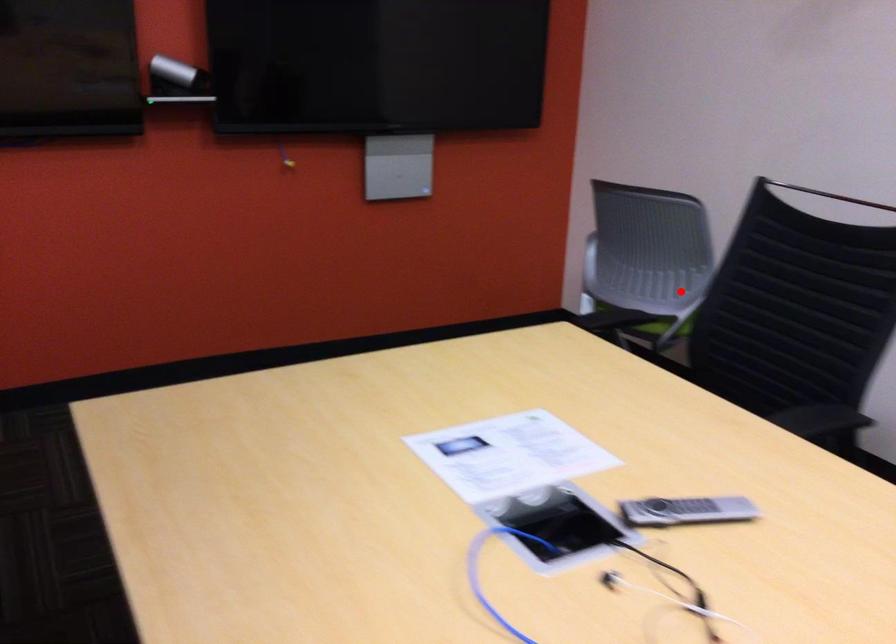
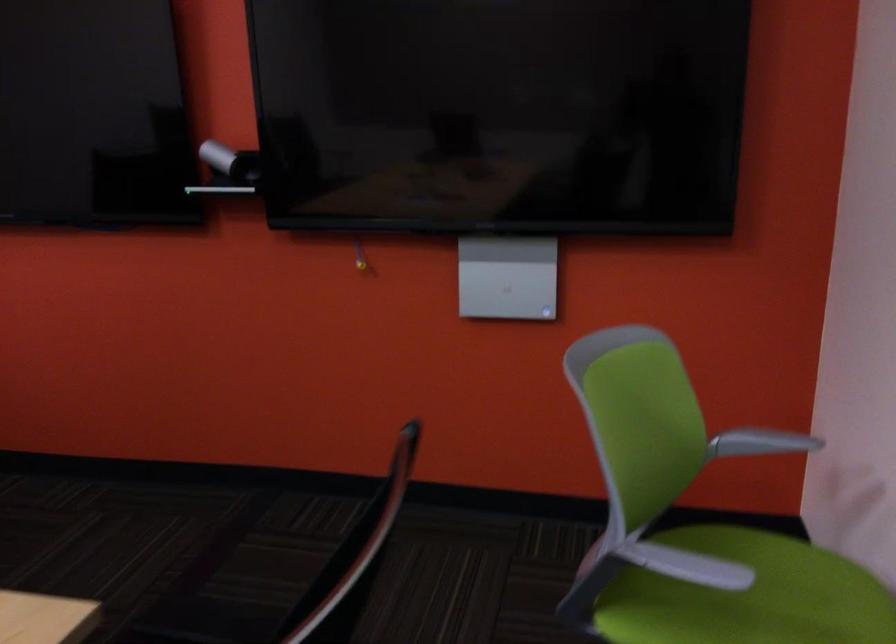
Question: I am providing you with two images of the same scene from different viewpoints. In image1, a red point is highlighted. Considering the same 3D point in image2, which of the following is correct?

Choices:
 (A) It is closer
 (B) It is farther

Answer: (A)